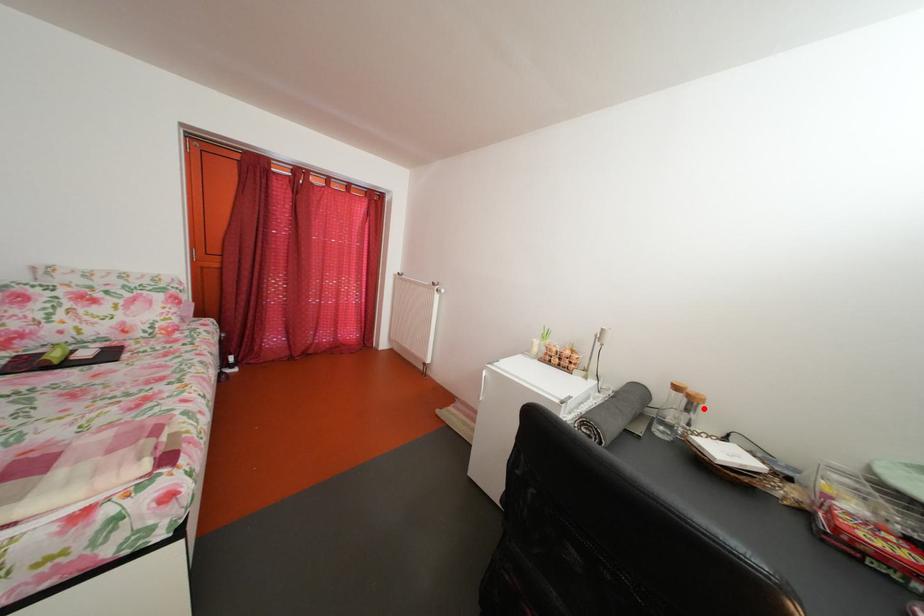
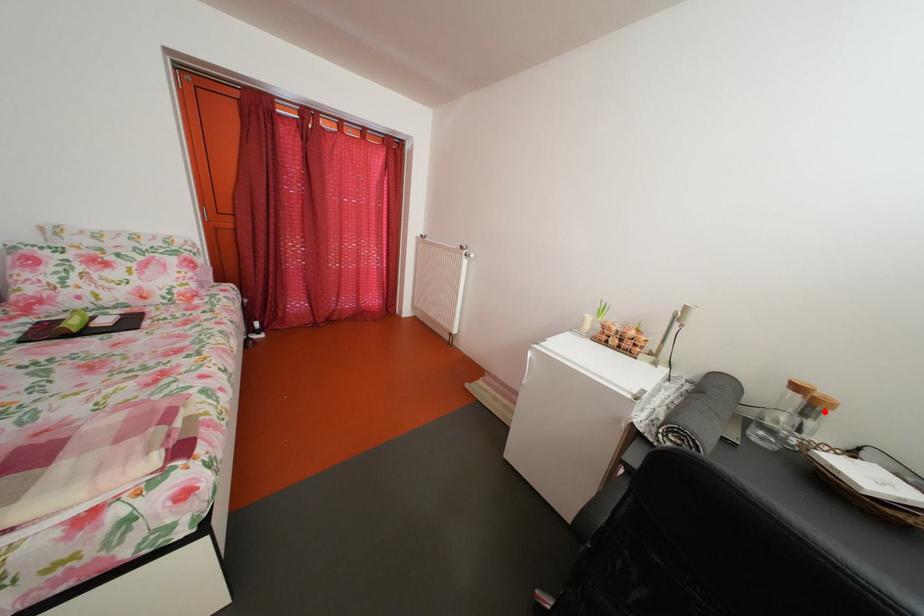
I am providing you with two images of the same scene from different viewpoints. A red point is marked on the first image and another point is marked on the second image. Do the highlighted points in image1 and image2 indicate the same real-world spot?

Yes